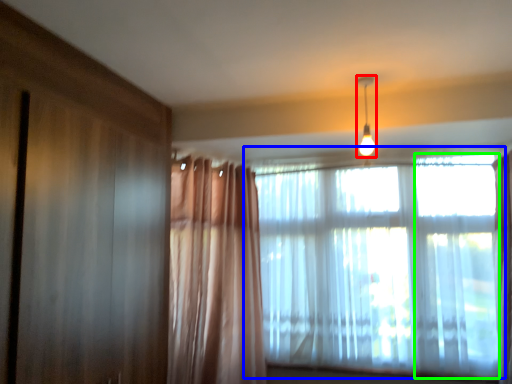
Question: Which object is positioned closest to light fixture (highlighted by a red box)? Select from window (highlighted by a blue box) and window (highlighted by a green box).

Choices:
 (A) window
 (B) window

Answer: (A)